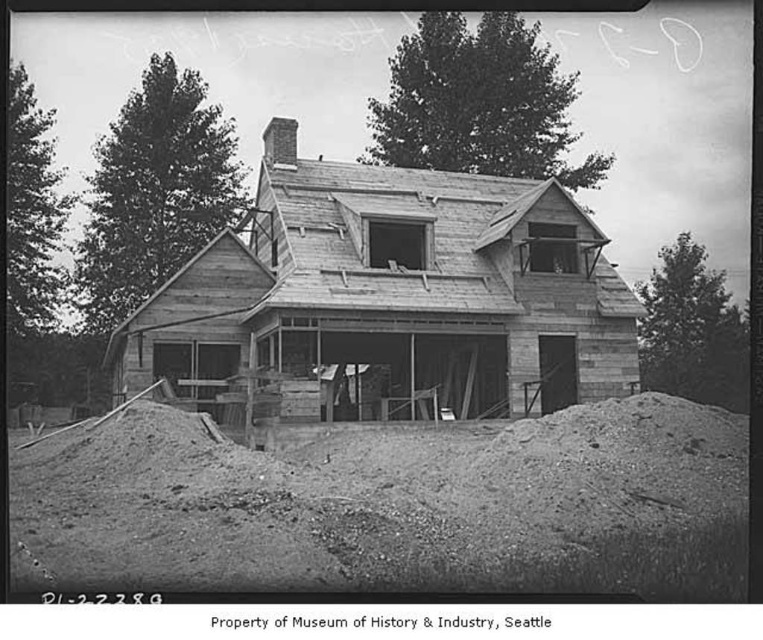
You are a construction worker who needs to move a heavy equipment that is 1.5 meters wide. You are standing on the loose gravel at lower center and want to move towards the wooden house at center. Is there enough space to move the equipment through the path between them?

The loose gravel at lower center is smaller than the wooden house at center, but the description does not provide specific measurements of the path width. Therefore, it is unclear if the 1.5 meter wide equipment can pass through safely. Further assessment of the path dimensions is required.